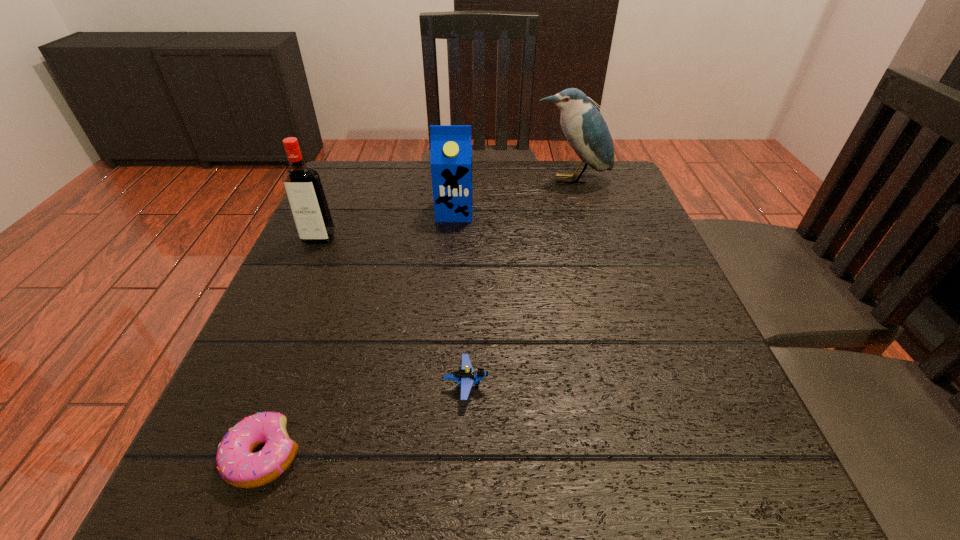
Locate an element on the screen. The height and width of the screenshot is (540, 960). free region located on the front-facing side of the Lego is located at coordinates (714, 385).

Where is `free location located on the right of the shortest object`? Image resolution: width=960 pixels, height=540 pixels. free location located on the right of the shortest object is located at coordinates (464, 456).

Locate an element on the screen. bird at the far edge is located at coordinates (584, 127).

This screenshot has height=540, width=960. Find the location of `carton positioned at the far edge`. carton positioned at the far edge is located at coordinates (451, 146).

Identify the location of object positioned at the near edge. (237, 465).

Locate an element on the screen. vodka located in the left edge section of the desktop is located at coordinates click(x=302, y=184).

Locate an element on the screen. doughnut situated at the left edge is located at coordinates (237, 465).

Locate an element on the screen. Image resolution: width=960 pixels, height=540 pixels. object at the right edge is located at coordinates click(x=584, y=127).

I want to click on object located in the near left corner section of the desktop, so click(x=237, y=465).

Where is `object located in the far right corner section of the desktop`? The image size is (960, 540). object located in the far right corner section of the desktop is located at coordinates (584, 127).